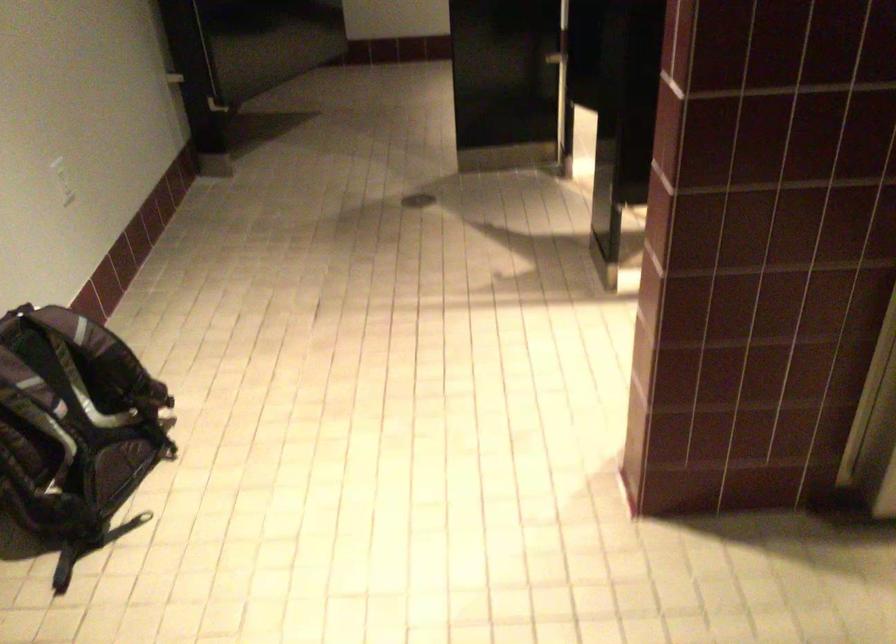
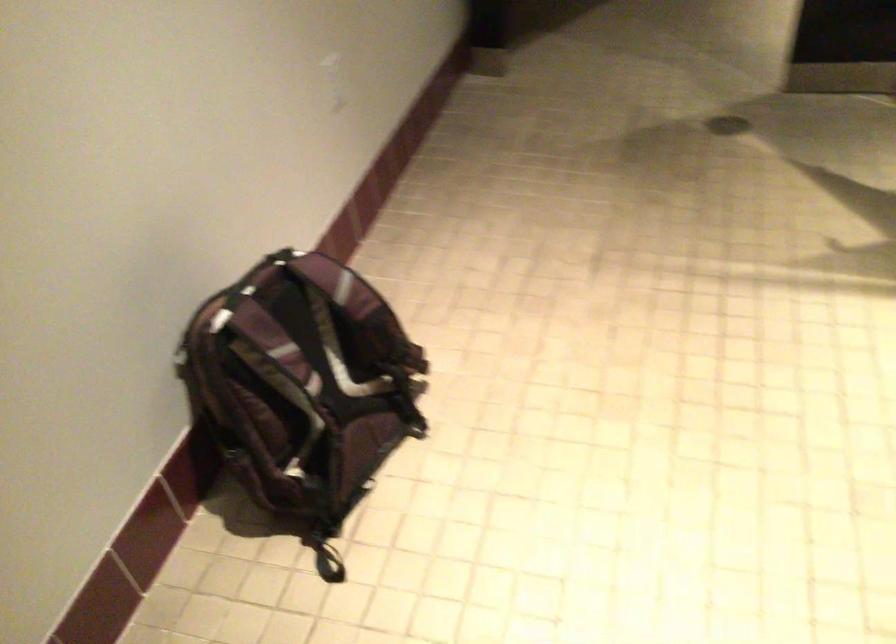
Looking at this image, in a continuous first-person perspective shot, in which direction is the camera moving?

The cameraman moved toward left, forward.